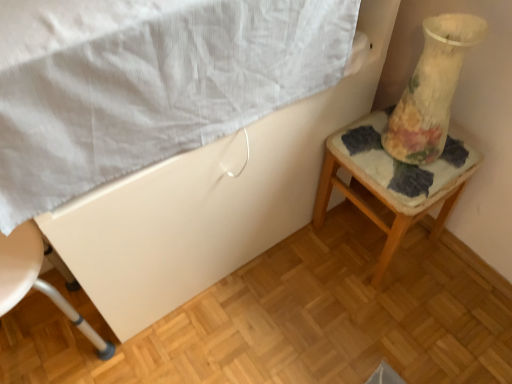
This screenshot has height=384, width=512. In order to click on vacant position to the left of floral fabric cushion at right in this screenshot , I will do `click(297, 269)`.